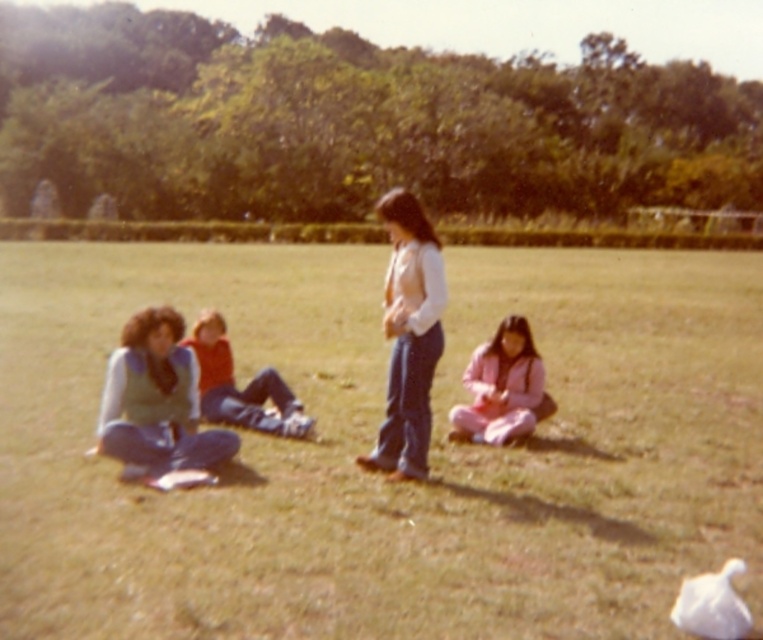
Does white matte vest at center have a lesser width compared to velvet red vest at lower left?

No, white matte vest at center is not thinner than velvet red vest at lower left.

Where is `white matte vest at center`? This screenshot has height=640, width=763. white matte vest at center is located at coordinates (407, 336).

Locate an element on the screen. This screenshot has height=640, width=763. white matte vest at center is located at coordinates (407, 336).

In the scene shown: Is green grass at center positioned before velvet red vest at lower left?

Yes.

Can you confirm if green grass at center is positioned above velvet red vest at lower left?

Yes.

Find the location of a particular element. This screenshot has height=640, width=763. green grass at center is located at coordinates (372, 444).

Find the location of a particular element. The height and width of the screenshot is (640, 763). green grass at center is located at coordinates (372, 444).

In the scene shown: Who is positioned more to the left, white matte vest at center or pink fleece jacket at lower right?

From the viewer's perspective, white matte vest at center appears more on the left side.

Between point (427, 401) and point (523, 358), which one is positioned behind?

The point (523, 358) is behind.

The width and height of the screenshot is (763, 640). What are the coordinates of `white matte vest at center` in the screenshot? It's located at (407, 336).